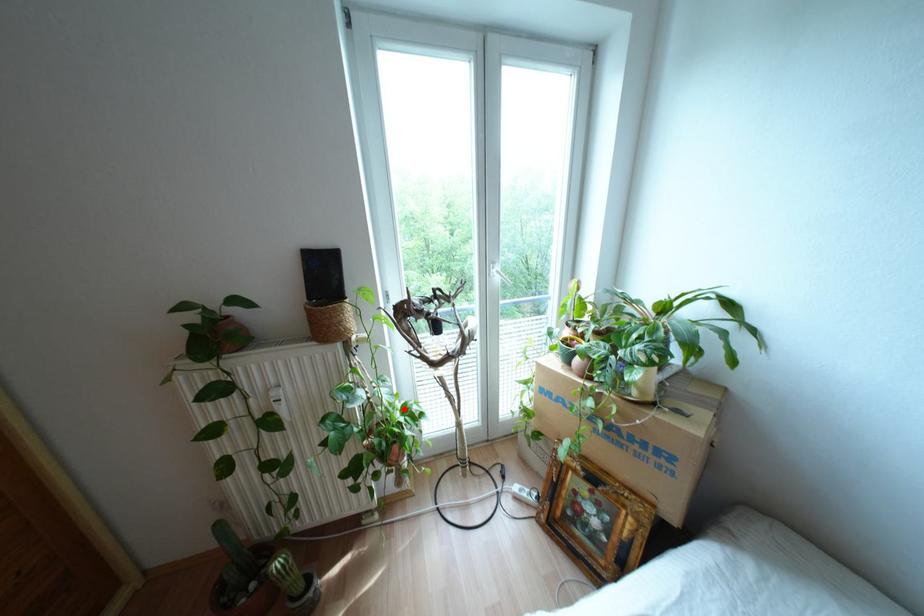
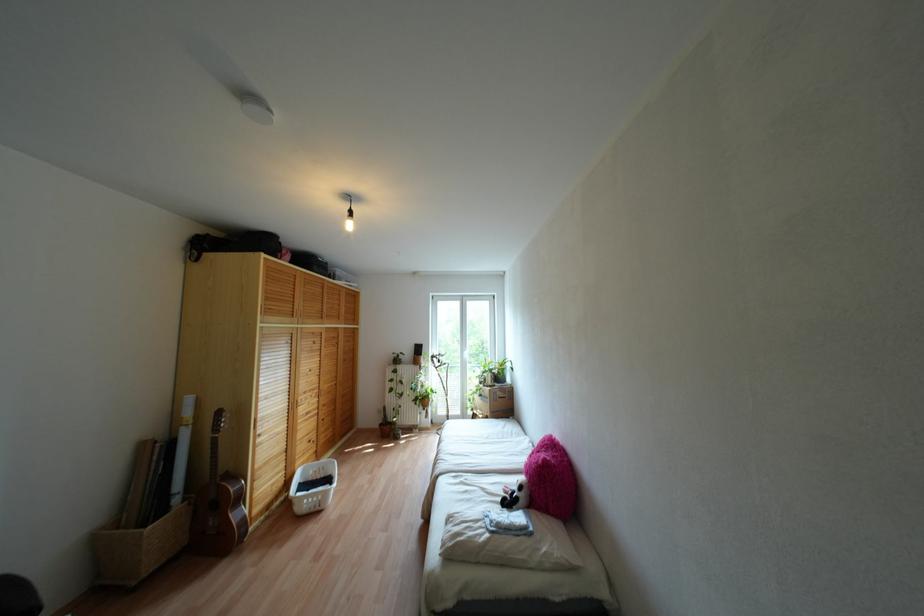
Question: I am providing you with two images of the same scene from different viewpoints. A red point is shown in image1. For the corresponding object point in image2, is it positioned nearer or farther from the camera?

Choices:
 (A) Nearer
 (B) Farther

Answer: (B)